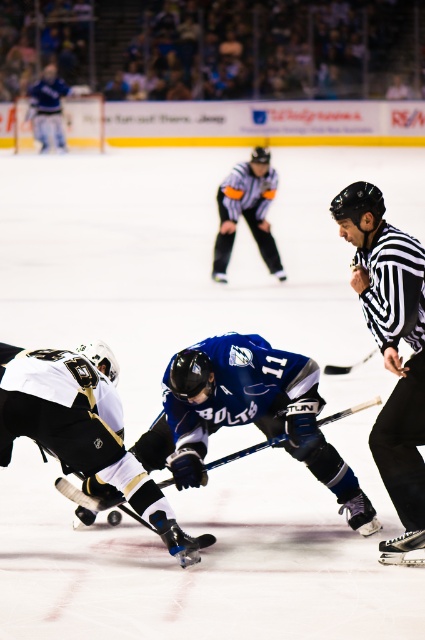
You are a referee watching the hockey game. You need to determine if the player in the black striped shirt at center is positioned to the right of the player in the white jersey at center. Based on the scene, what is your observation?

The black striped shirt at center is positioned to the right of the white jersey at center, so the player in the black striped shirt at center is indeed to the right of the player in the white jersey at center.

You are a referee observing the hockey game. You notice two players at the center of the rink wearing the white jersey at center and striped jersey at center. Based on their jersey sizes, which player might have a better chance of reaching the puck first if they are leaning forward equally?

The white jersey at center has a smaller size compared to striped jersey at center. Since the white jersey player is smaller, they might have a better chance of reaching the puck first due to their lower center of gravity and quicker movements.

You are a referee watching the hockey game. You notice a point marked at coordinates (82, 429). Based on the scene, which player is this point likely indicating?

The point is on the white jersey at center, so it is indicating the player wearing the white jersey with black and gold accents and the number 9.